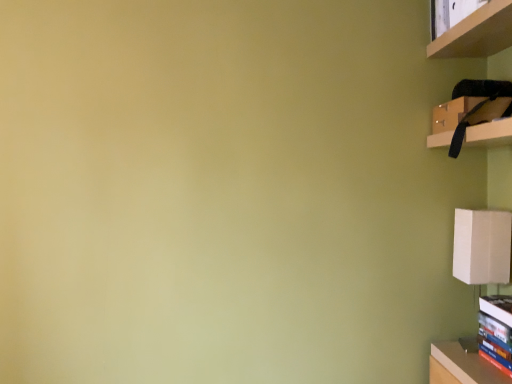
Image resolution: width=512 pixels, height=384 pixels. Describe the element at coordinates (489, 125) in the screenshot. I see `matte black cabinet at upper right` at that location.

What do you see at coordinates (477, 33) in the screenshot? I see `wooden shelf at upper right` at bounding box center [477, 33].

The image size is (512, 384). I want to click on matte black cabinet at upper right, so click(489, 125).

Which is behind, wooden shelf at upper right or hardcover book at lower right?

hardcover book at lower right.

I want to click on book on the right of wooden shelf at upper right, so click(496, 330).

Consider the image. Which is more to the right, wooden shelf at upper right or hardcover book at lower right?

hardcover book at lower right is more to the right.

Considering the sizes of wooden shelf at upper right and hardcover book at lower right in the image, is wooden shelf at upper right taller or shorter than hardcover book at lower right?

Considering their sizes, wooden shelf at upper right has less height than hardcover book at lower right.

From a real-world perspective, who is located higher, hardcover book at lower right or matte black cabinet at upper right?

matte black cabinet at upper right, from a real-world perspective.

Looking at this image, is hardcover book at lower right bigger or smaller than matte black cabinet at upper right?

hardcover book at lower right is smaller than matte black cabinet at upper right.

Which is more to the left, hardcover book at lower right or matte black cabinet at upper right?

matte black cabinet at upper right.

From the image's perspective, is hardcover book at lower right beneath matte black cabinet at upper right?

Yes, from the image's perspective, hardcover book at lower right is below matte black cabinet at upper right.

From the image's perspective, is wooden shelf at upper right under matte black cabinet at upper right?

No.

Is matte black cabinet at upper right surrounded by wooden shelf at upper right?

No, matte black cabinet at upper right is not a part of wooden shelf at upper right.

Considering the sizes of wooden shelf at upper right and matte black cabinet at upper right in the image, is wooden shelf at upper right bigger or smaller than matte black cabinet at upper right?

Clearly, wooden shelf at upper right is smaller in size than matte black cabinet at upper right.

Which is behind, point (465, 109) or point (508, 11)?

The point (465, 109) is more distant.

The width and height of the screenshot is (512, 384). I want to click on shelf above the matte black cabinet at upper right (from the image's perspective), so click(477, 33).

Considering their positions, is matte black cabinet at upper right located in front of or behind wooden shelf at upper right?

matte black cabinet at upper right is behind wooden shelf at upper right.

Is matte black cabinet at upper right to the left or to the right of wooden shelf at upper right in the image?

From the image, it's evident that matte black cabinet at upper right is to the right of wooden shelf at upper right.

Is hardcover book at lower right to the left or to the right of wooden shelf at upper right in the image?

In the image, hardcover book at lower right appears on the right side of wooden shelf at upper right.

Is hardcover book at lower right not close to wooden shelf at upper right?

hardcover book at lower right is actually quite close to wooden shelf at upper right.

Based on the photo, which point is more distant from viewer, [499,301] or [494,35]?

The point [499,301] is behind.

From a real-world perspective, is hardcover book at lower right on top of wooden shelf at upper right?

No, from a real-world perspective, hardcover book at lower right is not on top of wooden shelf at upper right.

Do you think matte black cabinet at upper right is within hardcover book at lower right, or outside of it?

matte black cabinet at upper right is outside hardcover book at lower right.

Considering the sizes of matte black cabinet at upper right and hardcover book at lower right in the image, is matte black cabinet at upper right wider or thinner than hardcover book at lower right?

Considering their sizes, matte black cabinet at upper right looks broader than hardcover book at lower right.

Are matte black cabinet at upper right and hardcover book at lower right far apart?

No, matte black cabinet at upper right is not far from hardcover book at lower right.

Which object is closer to the camera taking this photo, matte black cabinet at upper right or hardcover book at lower right?

matte black cabinet at upper right is more forward.

The image size is (512, 384). I want to click on shelf on the left of hardcover book at lower right, so click(x=477, y=33).

Where is `book behind the matte black cabinet at upper right`? This screenshot has width=512, height=384. book behind the matte black cabinet at upper right is located at coordinates (496, 330).

From the picture: Estimate the real-world distances between objects in this image. Which object is further from hardcover book at lower right, matte black cabinet at upper right or wooden shelf at upper right?

Based on the image, wooden shelf at upper right appears to be further to hardcover book at lower right.

When comparing their distances from wooden shelf at upper right, does matte black cabinet at upper right or hardcover book at lower right seem further?

hardcover book at lower right.

Based on their spatial positions, is hardcover book at lower right or matte black cabinet at upper right further from wooden shelf at upper right?

Among the two, hardcover book at lower right is located further to wooden shelf at upper right.

Looking at the image, which one is located further to hardcover book at lower right, wooden shelf at upper right or matte black cabinet at upper right?

The object further to hardcover book at lower right is wooden shelf at upper right.

From the image, which object appears to be nearer to matte black cabinet at upper right, wooden shelf at upper right or hardcover book at lower right?

The object closer to matte black cabinet at upper right is wooden shelf at upper right.

From the image, which object appears to be nearer to matte black cabinet at upper right, hardcover book at lower right or wooden shelf at upper right?

wooden shelf at upper right.

Locate an element on the screen. The image size is (512, 384). cabinet between wooden shelf at upper right and hardcover book at lower right in the vertical direction is located at coordinates (489, 125).